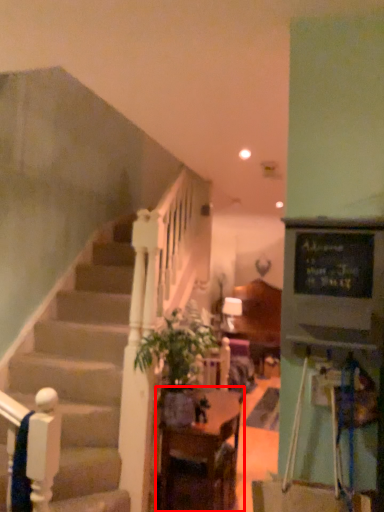
Question: From the image's perspective, considering the relative positions of table (annotated by the red box) and houseplant in the image provided, where is table (annotated by the red box) located with respect to the staircase?

Choices:
 (A) above
 (B) below

Answer: (B)